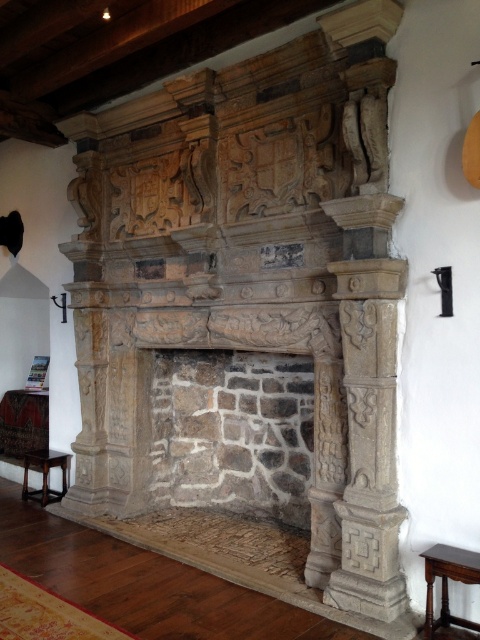
Between stone fireplace at center and dark brown wood stool at lower left, which one is positioned higher?

stone fireplace at center is above.

Who is shorter, stone fireplace at center or dark brown wood stool at lower left?

dark brown wood stool at lower left is shorter.

Is point (135, 452) behind point (61, 476)?

No.

Locate an element on the screen. This screenshot has height=640, width=480. stone fireplace at center is located at coordinates (252, 275).

Between wooden stool at lower right and dark brown wood stool at lower left, which one appears on the right side from the viewer's perspective?

Positioned to the right is wooden stool at lower right.

Between wooden stool at lower right and dark brown wood stool at lower left, which one has more height?

With more height is dark brown wood stool at lower left.

Which is in front, point (428, 548) or point (34, 490)?

Point (428, 548) is in front.

Identify the location of wooden stool at lower right. (446, 582).

Does stone fireplace at center have a lesser width compared to wooden stool at lower right?

No, stone fireplace at center is not thinner than wooden stool at lower right.

Is stone fireplace at center behind wooden stool at lower right?

Yes, stone fireplace at center is further from the viewer.

Is point (372, 486) closer to camera compared to point (462, 552)?

No, (372, 486) is behind (462, 552).

At what (x,y) coordinates should I click in order to perform the action: click on stone fireplace at center. Please return your answer as a coordinate pair (x, y). This screenshot has width=480, height=640. Looking at the image, I should click on (252, 275).